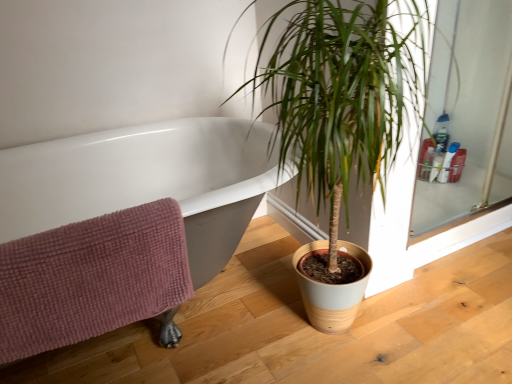
What are the coordinates of `green leafy plant at center` in the screenshot? It's located at (343, 115).

In order to click on translucent plastic bottle at upper right, which ranks as the 3th toiletry in left-to-right order in this screenshot , I will do (457, 166).

The image size is (512, 384). Describe the element at coordinates (146, 181) in the screenshot. I see `white glossy bathtub at upper left` at that location.

This screenshot has width=512, height=384. Describe the element at coordinates (448, 162) in the screenshot. I see `translucent plastic bottles at upper right, positioned as the second toiletry in left-to-right order` at that location.

This screenshot has height=384, width=512. What do you see at coordinates (94, 280) in the screenshot? I see `pink waffle-textured towel at lower left` at bounding box center [94, 280].

Locate an element on the screen. This screenshot has width=512, height=384. translucent plastic bottles at upper right, arranged as the 1th toiletry when viewed from the left is located at coordinates (436, 162).

You are a GUI agent. You are given a task and a screenshot of the screen. Output one action in this format:
    pyautogui.click(x=<x>, y=<y>)
    Task: Click on the toiletry that appears in front of the translucent plastic bottle at upper right, which ranks as the 3th toiletry in left-to-right order
    The image size is (512, 384).
    Given the screenshot: What is the action you would take?
    pyautogui.click(x=448, y=162)

Is translucent plastic bottle at upper right, which is counted as the first toiletry, starting from the right, oriented away from translucent plastic bottles at upper right, the 2th toiletry in the right-to-left sequence?

Absolutely, translucent plastic bottle at upper right, which is counted as the first toiletry, starting from the right, is directed away from translucent plastic bottles at upper right, the 2th toiletry in the right-to-left sequence.

Considering the relative positions of translucent plastic bottle at upper right, which is counted as the first toiletry, starting from the right, and translucent plastic bottles at upper right, positioned as the second toiletry in left-to-right order, in the image provided, is translucent plastic bottle at upper right, which is counted as the first toiletry, starting from the right, in front of translucent plastic bottles at upper right, positioned as the second toiletry in left-to-right order,?

No, the depth of translucent plastic bottle at upper right, which is counted as the first toiletry, starting from the right, is greater than that of translucent plastic bottles at upper right, positioned as the second toiletry in left-to-right order.

How many degrees apart are the facing directions of translucent plastic bottle at upper right, which ranks as the 3th toiletry in left-to-right order, and translucent plastic bottles at upper right, the 2th toiletry in the right-to-left sequence?

0.00587 degrees separate the facing orientations of translucent plastic bottle at upper right, which ranks as the 3th toiletry in left-to-right order, and translucent plastic bottles at upper right, the 2th toiletry in the right-to-left sequence.

In the image, is translucent plastic bottles at upper right, the 2th toiletry in the right-to-left sequence, positioned in front of or behind green leafy plant at center?

translucent plastic bottles at upper right, the 2th toiletry in the right-to-left sequence, is positioned farther from the viewer than green leafy plant at center.

Could you measure the distance between translucent plastic bottles at upper right, positioned as the second toiletry in left-to-right order, and green leafy plant at center?

The distance of translucent plastic bottles at upper right, positioned as the second toiletry in left-to-right order, from green leafy plant at center is 4.42 feet.

Is translucent plastic bottles at upper right, positioned as the second toiletry in left-to-right order, not near green leafy plant at center?

Yes, translucent plastic bottles at upper right, positioned as the second toiletry in left-to-right order, is far from green leafy plant at center.

Is translucent plastic bottles at upper right, arranged as the 1th toiletry when viewed from the left, far from pink waffle-textured towel at lower left?

Yes, translucent plastic bottles at upper right, arranged as the 1th toiletry when viewed from the left, is far from pink waffle-textured towel at lower left.

Is the depth of translucent plastic bottles at upper right, arranged as the 1th toiletry when viewed from the left, greater than that of pink waffle-textured towel at lower left?

Yes.

At what (x,y) coordinates should I click in order to perform the action: click on bath towel that appears below the translucent plastic bottles at upper right, arranged as the 1th toiletry when viewed from the left (from the image's perspective). Please return your answer as a coordinate pair (x, y). The height and width of the screenshot is (384, 512). Looking at the image, I should click on (94, 280).

Identify the location of the 1st toiletry in front of the translucent plastic bottles at upper right, acting as the third toiletry starting from the right. The height and width of the screenshot is (384, 512). (457, 166).

Considering the relative sizes of translucent plastic bottle at upper right, which is counted as the first toiletry, starting from the right, and translucent plastic bottles at upper right, acting as the third toiletry starting from the right, in the image provided, is translucent plastic bottle at upper right, which is counted as the first toiletry, starting from the right, shorter than translucent plastic bottles at upper right, acting as the third toiletry starting from the right,?

Yes.

Is translucent plastic bottle at upper right, which is counted as the first toiletry, starting from the right, in front of translucent plastic bottles at upper right, acting as the third toiletry starting from the right?

Yes, translucent plastic bottle at upper right, which is counted as the first toiletry, starting from the right, is closer to the viewer.

Are white glossy bathtub at upper left and green leafy plant at center beside each other?

No, white glossy bathtub at upper left is not next to green leafy plant at center.

Image resolution: width=512 pixels, height=384 pixels. Identify the location of bathtub below the green leafy plant at center (from the image's perspective). (146, 181).

Considering the relative sizes of white glossy bathtub at upper left and green leafy plant at center in the image provided, is white glossy bathtub at upper left bigger than green leafy plant at center?

Correct, white glossy bathtub at upper left is larger in size than green leafy plant at center.

Is point (203, 139) positioned behind point (335, 314)?

Yes, it is.

From a real-world perspective, which is physically above, green leafy plant at center or translucent plastic bottles at upper right, arranged as the 1th toiletry when viewed from the left?

green leafy plant at center, from a real-world perspective.

This screenshot has width=512, height=384. I want to click on houseplant in front of the translucent plastic bottles at upper right, acting as the third toiletry starting from the right, so click(x=343, y=115).

Who is shorter, green leafy plant at center or translucent plastic bottles at upper right, acting as the third toiletry starting from the right?

Standing shorter between the two is translucent plastic bottles at upper right, acting as the third toiletry starting from the right.

Is white glossy bathtub at upper left further to camera compared to translucent plastic bottles at upper right, arranged as the 1th toiletry when viewed from the left?

No, it is in front of translucent plastic bottles at upper right, arranged as the 1th toiletry when viewed from the left.

Which is behind, point (167, 128) or point (435, 150)?

Point (435, 150)

From the image's perspective, between white glossy bathtub at upper left and translucent plastic bottles at upper right, acting as the third toiletry starting from the right, who is located below?

white glossy bathtub at upper left is shown below in the image.

Considering the positions of objects white glossy bathtub at upper left and translucent plastic bottles at upper right, acting as the third toiletry starting from the right, in the image provided, who is more to the left, white glossy bathtub at upper left or translucent plastic bottles at upper right, acting as the third toiletry starting from the right,?

Positioned to the left is white glossy bathtub at upper left.

The width and height of the screenshot is (512, 384). Identify the location of the 1st toiletry to the left when counting from the translucent plastic bottle at upper right, which ranks as the 3th toiletry in left-to-right order. (448, 162).

Locate an element on the screen. houseplant in front of the translucent plastic bottles at upper right, the 2th toiletry in the right-to-left sequence is located at coordinates (343, 115).

When comparing their distances from white glossy bathtub at upper left, does translucent plastic bottle at upper right, which ranks as the 3th toiletry in left-to-right order, or pink waffle-textured towel at lower left seem closer?

pink waffle-textured towel at lower left is closer to white glossy bathtub at upper left.

Based on their spatial positions, is translucent plastic bottles at upper right, the 2th toiletry in the right-to-left sequence, or green leafy plant at center closer to translucent plastic bottles at upper right, arranged as the 1th toiletry when viewed from the left?

translucent plastic bottles at upper right, the 2th toiletry in the right-to-left sequence, is positioned closer to the anchor translucent plastic bottles at upper right, arranged as the 1th toiletry when viewed from the left.

Looking at the image, which one is located further to pink waffle-textured towel at lower left, translucent plastic bottles at upper right, acting as the third toiletry starting from the right, or green leafy plant at center?

Based on the image, translucent plastic bottles at upper right, acting as the third toiletry starting from the right, appears to be further to pink waffle-textured towel at lower left.

In the scene shown: Based on their spatial positions, is translucent plastic bottles at upper right, positioned as the second toiletry in left-to-right order, or white glossy bathtub at upper left further from pink waffle-textured towel at lower left?

Based on the image, translucent plastic bottles at upper right, positioned as the second toiletry in left-to-right order, appears to be further to pink waffle-textured towel at lower left.

Looking at the image, which one is located closer to pink waffle-textured towel at lower left, translucent plastic bottle at upper right, which ranks as the 3th toiletry in left-to-right order, or green leafy plant at center?

Based on the image, green leafy plant at center appears to be nearer to pink waffle-textured towel at lower left.

In the scene shown: Which object lies nearer to the anchor point white glossy bathtub at upper left, translucent plastic bottles at upper right, positioned as the second toiletry in left-to-right order, or pink waffle-textured towel at lower left?

pink waffle-textured towel at lower left.

Estimate the real-world distances between objects in this image. Which object is closer to pink waffle-textured towel at lower left, green leafy plant at center or translucent plastic bottles at upper right, positioned as the second toiletry in left-to-right order?

green leafy plant at center.

When comparing their distances from translucent plastic bottles at upper right, the 2th toiletry in the right-to-left sequence, does green leafy plant at center or white glossy bathtub at upper left seem further?

white glossy bathtub at upper left lies further to translucent plastic bottles at upper right, the 2th toiletry in the right-to-left sequence, than the other object.

The image size is (512, 384). What are the coordinates of `toiletry positioned between green leafy plant at center and translucent plastic bottle at upper right, which is counted as the first toiletry, starting from the right, from near to far` in the screenshot? It's located at (448, 162).

Identify the location of toiletry between white glossy bathtub at upper left and translucent plastic bottle at upper right, which is counted as the first toiletry, starting from the right, in the front-back direction. The image size is (512, 384). (448, 162).

What are the coordinates of `bath towel between white glossy bathtub at upper left and translucent plastic bottle at upper right, which ranks as the 3th toiletry in left-to-right order, along the z-axis` in the screenshot? It's located at (94, 280).

Locate an element on the screen. bathtub between pink waffle-textured towel at lower left and green leafy plant at center from left to right is located at coordinates (146, 181).